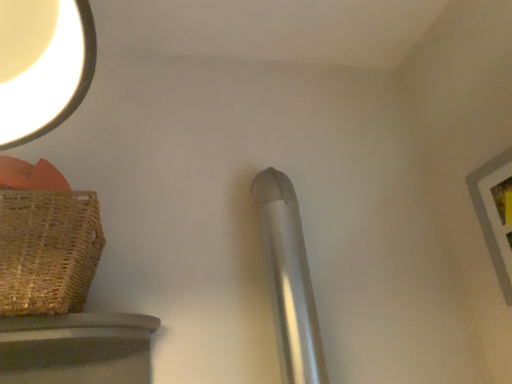
Question: Should I look upward or downward to see wooden picture frame at upper right?

Choices:
 (A) down
 (B) up

Answer: (A)

Question: Should I look upward or downward to see brown woven basket at left?

Choices:
 (A) down
 (B) up

Answer: (A)

Question: Does wooden picture frame at upper right have a smaller size compared to brown woven basket at left?

Choices:
 (A) no
 (B) yes

Answer: (B)

Question: Is wooden picture frame at upper right wider than brown woven basket at left?

Choices:
 (A) no
 (B) yes

Answer: (A)

Question: Considering the relative positions of wooden picture frame at upper right and brown woven basket at left in the image provided, is wooden picture frame at upper right behind brown woven basket at left?

Choices:
 (A) no
 (B) yes

Answer: (B)

Question: Does wooden picture frame at upper right have a lesser height compared to brown woven basket at left?

Choices:
 (A) yes
 (B) no

Answer: (B)

Question: Is brown woven basket at left inside wooden picture frame at upper right?

Choices:
 (A) yes
 (B) no

Answer: (B)

Question: Does wooden picture frame at upper right come in front of brown woven basket at left?

Choices:
 (A) yes
 (B) no

Answer: (B)

Question: Is silver metallic pipe at center shorter than wooden picture frame at upper right?

Choices:
 (A) yes
 (B) no

Answer: (B)

Question: Can you confirm if silver metallic pipe at center is positioned to the right of wooden picture frame at upper right?

Choices:
 (A) no
 (B) yes

Answer: (A)

Question: Can you confirm if silver metallic pipe at center is smaller than wooden picture frame at upper right?

Choices:
 (A) yes
 (B) no

Answer: (B)

Question: From a real-world perspective, is silver metallic pipe at center positioned over wooden picture frame at upper right based on gravity?

Choices:
 (A) no
 (B) yes

Answer: (A)

Question: Is silver metallic pipe at center oriented away from wooden picture frame at upper right?

Choices:
 (A) no
 (B) yes

Answer: (A)

Question: Can you confirm if silver metallic pipe at center is positioned to the left of wooden picture frame at upper right?

Choices:
 (A) no
 (B) yes

Answer: (B)

Question: Are brown woven basket at left and wooden picture frame at upper right beside each other?

Choices:
 (A) no
 (B) yes

Answer: (A)